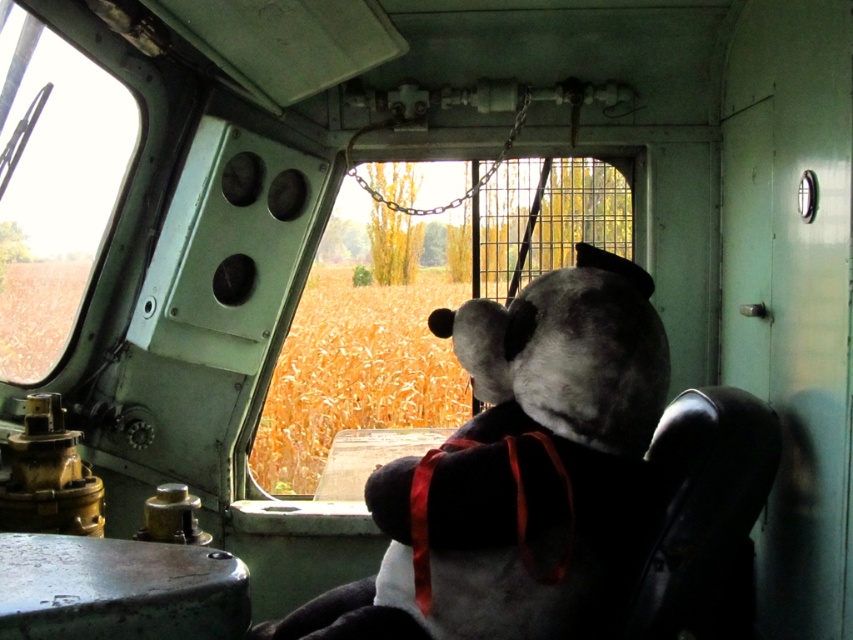
Which of these two, soft plush teddy bear at center or clear glass window at center, stands taller?

soft plush teddy bear at center

Between soft plush teddy bear at center and clear glass window at center, which one has less height?

With less height is clear glass window at center.

This screenshot has width=853, height=640. Describe the element at coordinates (515, 470) in the screenshot. I see `soft plush teddy bear at center` at that location.

You are a GUI agent. You are given a task and a screenshot of the screen. Output one action in this format:
    pyautogui.click(x=<x>, y=<y>)
    Task: Click on the soft plush teddy bear at center
    This screenshot has height=640, width=853.
    Given the screenshot: What is the action you would take?
    pyautogui.click(x=515, y=470)

Does soft plush teddy bear at center have a lesser width compared to transparent glass window at upper left?

No.

Can you confirm if soft plush teddy bear at center is bigger than transparent glass window at upper left?

Indeed, soft plush teddy bear at center has a larger size compared to transparent glass window at upper left.

Image resolution: width=853 pixels, height=640 pixels. Identify the location of soft plush teddy bear at center. (515, 470).

Which of these two, clear glass window at center or transparent glass window at upper left, stands taller?

Standing taller between the two is transparent glass window at upper left.

Is point (538, 177) positioned after point (30, 209)?

Yes, it is.

Does point (535, 260) come farther from viewer compared to point (138, 120)?

Yes, it is.

Where is `clear glass window at center`? clear glass window at center is located at coordinates (421, 317).